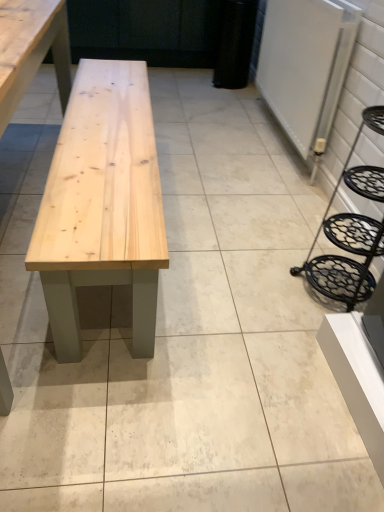
You are a GUI agent. You are given a task and a screenshot of the screen. Output one action in this format:
    pyautogui.click(x=<x>, y=<y>)
    Task: Click on the vacant space that is to the left of black wrought iron step stool at right
    Image resolution: width=384 pixels, height=512 pixels.
    Given the screenshot: What is the action you would take?
    pyautogui.click(x=266, y=281)